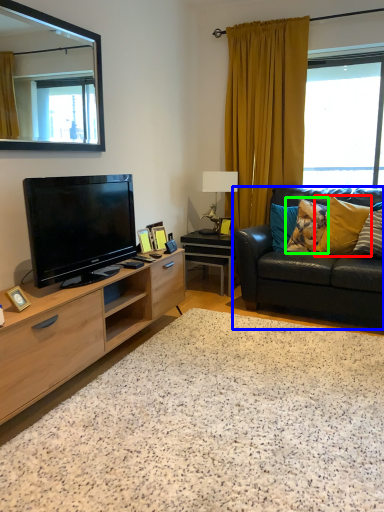
Question: Which object is the closest to the pillow (highlighted by a red box)? Choose among these: studio couch (highlighted by a blue box) or pillow (highlighted by a green box).

Choices:
 (A) studio couch
 (B) pillow

Answer: (B)